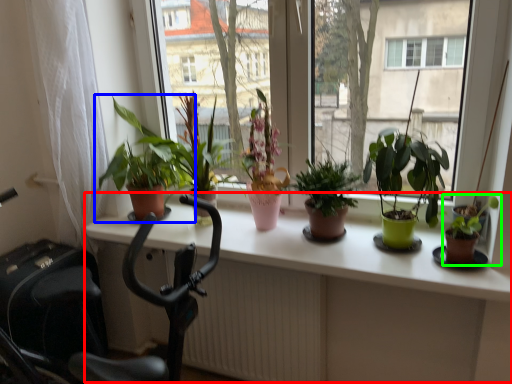
Question: Which object is positioned closest to table (highlighted by a red box)? Select from houseplant (highlighted by a blue box) and houseplant (highlighted by a green box).

Choices:
 (A) houseplant
 (B) houseplant

Answer: (A)